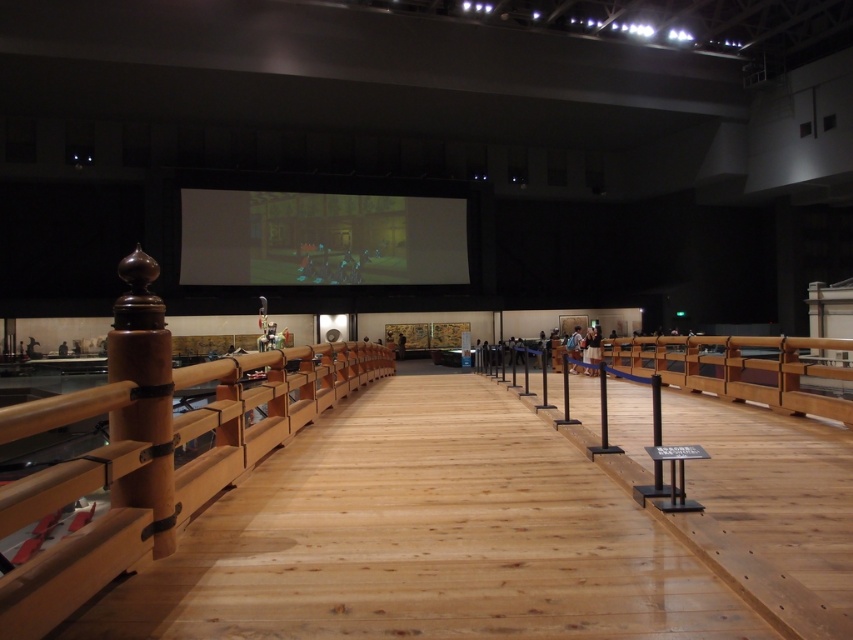
You are standing on the wooden walkway in the museum and want to see the matte black screen at center without moving your feet. Which direction should you turn your head to look towards the natural wood railing at left?

Since the natural wood railing at left is to the right of the matte black screen at center, you should turn your head to the right to look towards the natural wood railing at left while facing the matte black screen at center.

You are standing at the entrance of the museum walkway and want to reach the projection screen. There are two points marked on the floor, point (321, 353) and point (358, 214). Which point should you step on first to get closer to the screen?

Point (321, 353) is closer to the viewer than point (358, 214), so stepping on point (321, 353) first would bring you closer to the projection screen.

You are standing at the point marked as point (x=380, y=348) in the museum. You want to take a photo of the large projection screen in the background. Is the distance between you and the screen sufficient to get a clear, full view of the screen in your camera?

The distance between you and the screen is 16.12 meters, which is sufficient for a clear, full view of the screen in your camera.